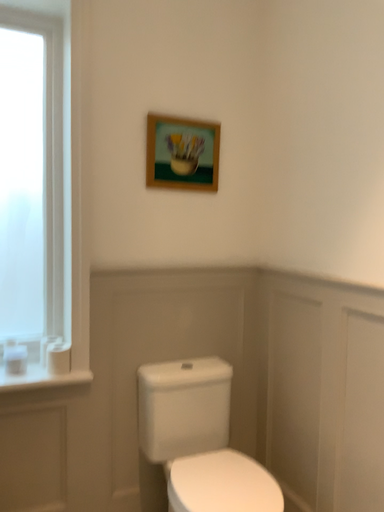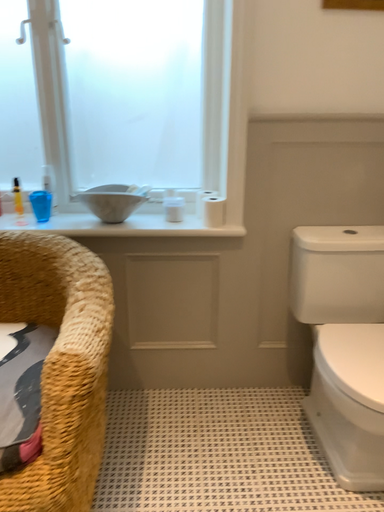
Question: How did the camera likely rotate when shooting the video?

Choices:
 (A) rotated right
 (B) rotated left

Answer: (B)